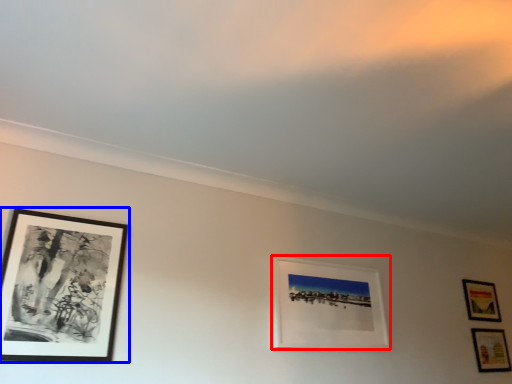
Question: Which of the following is the farthest to the observer, picture frame (highlighted by a red box) or picture frame (highlighted by a blue box)?

Choices:
 (A) picture frame
 (B) picture frame

Answer: (A)